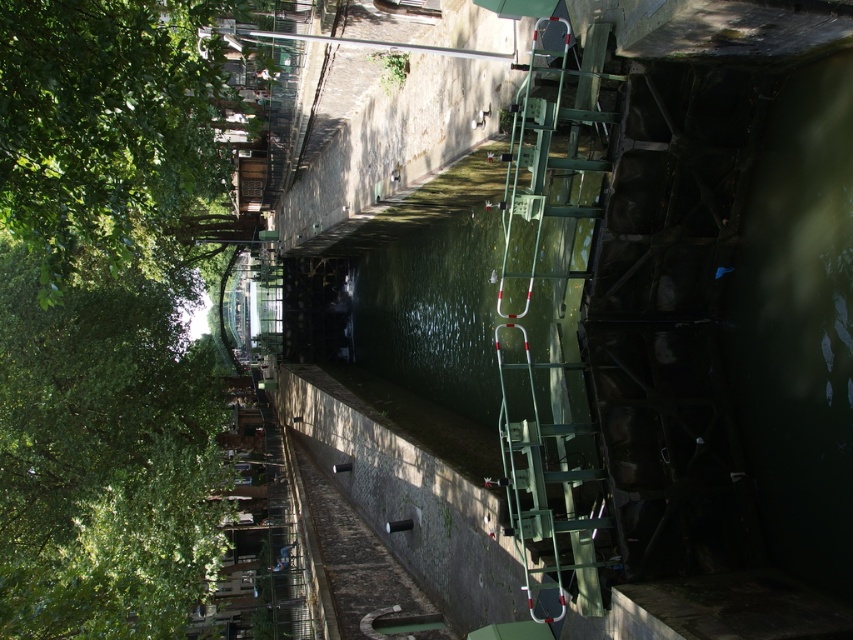
You are standing at the center of the canal scene. Which direction should you look to see the green leafy tree at left?

The green leafy tree at left is located at point (103,458), which is to the left side of the scene. Therefore, you should look to the left to see it.

You are a painter setting up an easel to capture the canal scene. You want to ensure that both the green leafy tree at upper left and the green metallic ladder at right are visible in your painting. Based on their widths, which object should you position closer to the center of your canvas to avoid cropping?

The green leafy tree at upper left is wider than the green metallic ladder at right, so positioning the green leafy tree at upper left closer to the center of the canvas will help ensure it isn not cropped while still allowing the green metallic ladder at right to be visible.

You are a tourist standing on the cobblestone path next to the canal. You want to take a photo that includes both the green leafy tree at left and the green leafy tree at upper left. Given that your camera can capture a maximum distance of 10 meters between the closest and farthest objects in focus, will both trees be in focus in the photo?

The green leafy tree at left is 9.22 meters away from the green leafy tree at upper left. Since the distance between them is less than the camera maximum distance of 10 meters, both trees will be in focus in the photo.